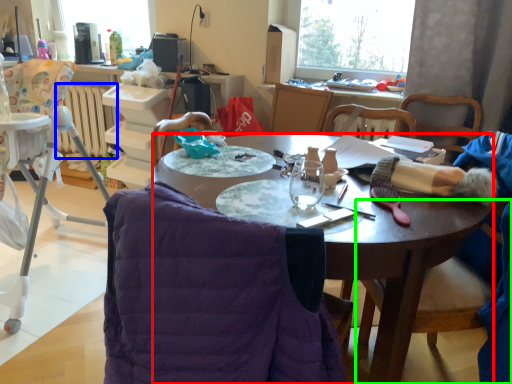
Question: Which object is positioned farthest from desk (highlighted by a red box)? Select from radiator (highlighted by a blue box) and chair (highlighted by a green box).

Choices:
 (A) radiator
 (B) chair

Answer: (A)